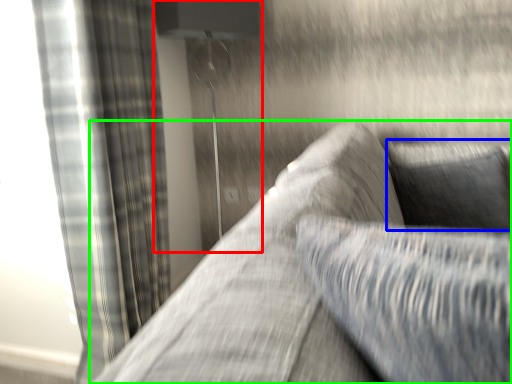
Question: Which object is the closest to the lamp (highlighted by a red box)? Choose among these: pillow (highlighted by a blue box) or studio couch (highlighted by a green box).

Choices:
 (A) pillow
 (B) studio couch

Answer: (B)